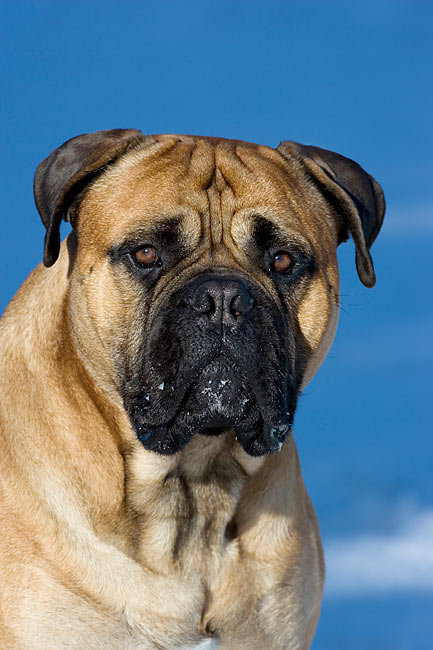
Where is `chest`? chest is located at coordinates (239, 530).